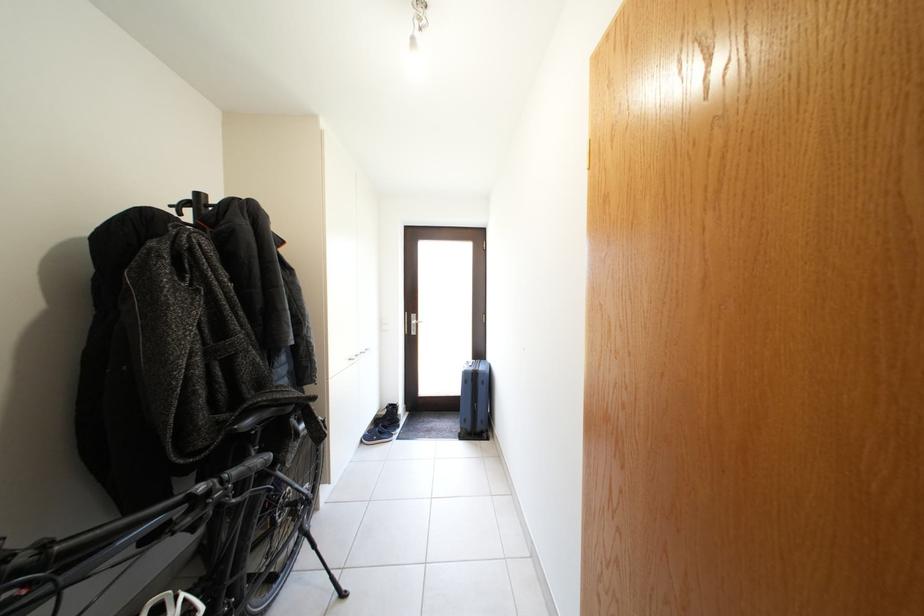
Identify the location of silver door handle. click(x=411, y=323).